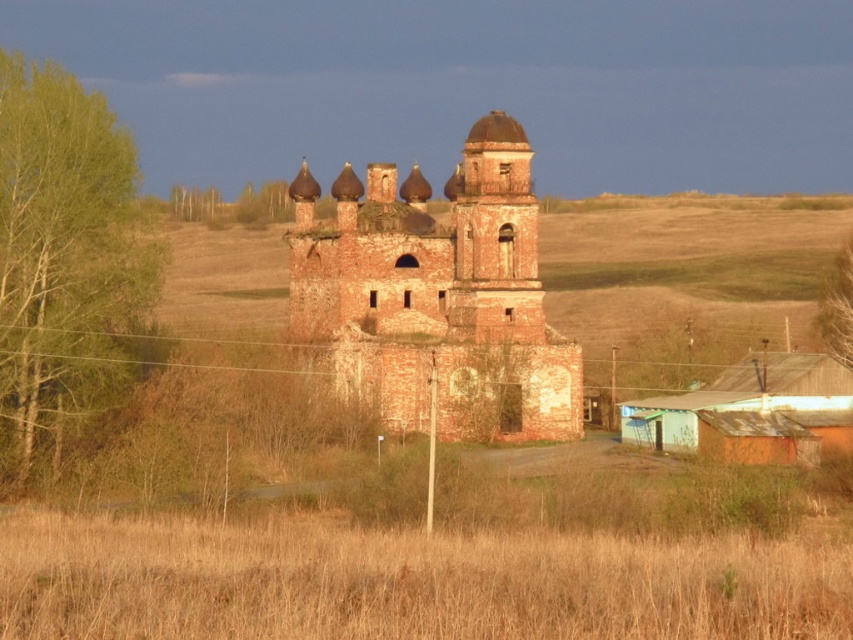
Is green leafy tree at left to the left of green leafy tree at right from the viewer's perspective?

Indeed, green leafy tree at left is positioned on the left side of green leafy tree at right.

Does green leafy tree at left have a lesser height compared to green leafy tree at right?

No.

Does point (33, 323) lie behind point (851, 300)?

No, it is not.

The height and width of the screenshot is (640, 853). I want to click on green leafy tree at left, so click(64, 260).

The image size is (853, 640). What are the coordinates of `red brick church at center` in the screenshot? It's located at (437, 294).

Between point (354, 356) and point (838, 360), which one is positioned in front?

Point (354, 356) is in front.

The height and width of the screenshot is (640, 853). I want to click on red brick church at center, so click(x=437, y=294).

The height and width of the screenshot is (640, 853). What are the coordinates of `brown corrugated metal hut at lower right` in the screenshot? It's located at [x=752, y=412].

Locate an element on the screen. brown corrugated metal hut at lower right is located at coordinates (752, 412).